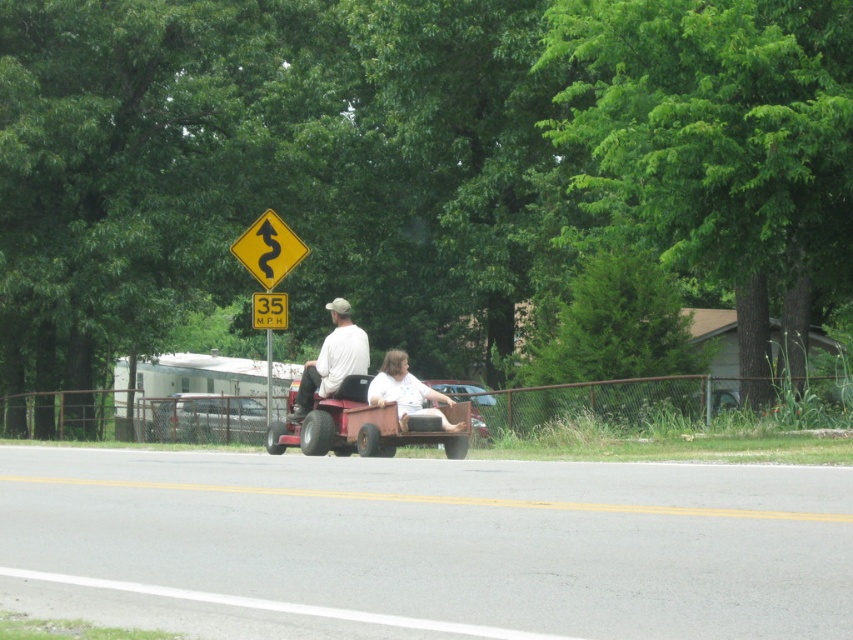
Is rusty metal wagon at center below yellow diamond-shaped road sign at upper center?

Indeed, rusty metal wagon at center is positioned under yellow diamond-shaped road sign at upper center.

Which of these two, rusty metal wagon at center or yellow diamond-shaped road sign at upper center, stands taller?

yellow diamond-shaped road sign at upper center

Does point (422, 433) lie behind point (262, 214)?

No, (422, 433) is closer to viewer.

Where is `rusty metal wagon at center`? The width and height of the screenshot is (853, 640). rusty metal wagon at center is located at coordinates (363, 426).

Who is more forward, (277, 250) or (463, 392)?

Positioned in front is point (277, 250).

Describe the element at coordinates (268, 250) in the screenshot. I see `yellow diamond-shaped road sign at upper center` at that location.

The width and height of the screenshot is (853, 640). Find the location of `yellow diamond-shaped road sign at upper center`. yellow diamond-shaped road sign at upper center is located at coordinates (268, 250).

Can you confirm if silver metallic car at center is wider than metallic silver car at center?

Yes, silver metallic car at center is wider than metallic silver car at center.

Is silver metallic car at center to the right of metallic silver car at center from the viewer's perspective?

In fact, silver metallic car at center is to the left of metallic silver car at center.

Which is behind, point (218, 422) or point (440, 387)?

The point (440, 387) is behind.

Find the location of a particular element. silver metallic car at center is located at coordinates (207, 419).